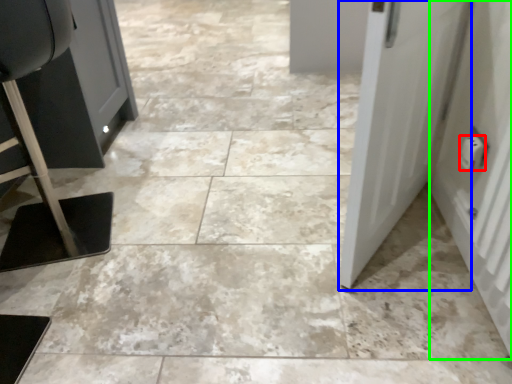
Question: Which is nearer to the electric outlet (highlighted by a red box)? door (highlighted by a blue box) or door (highlighted by a green box).

Choices:
 (A) door
 (B) door

Answer: (B)